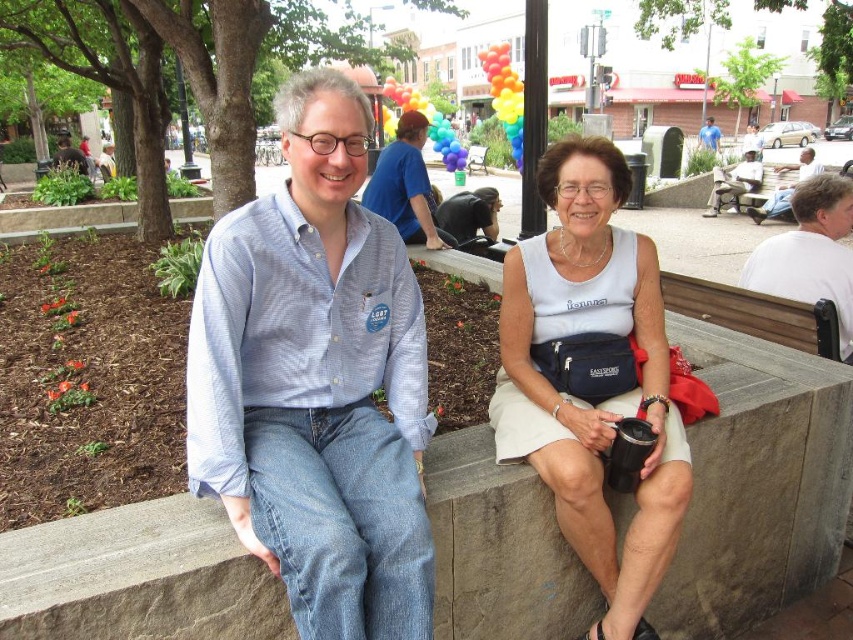
From the picture: Is white fabric tank top at center to the right of wooden bench at center from the viewer's perspective?

No, white fabric tank top at center is not to the right of wooden bench at center.

Which of these two, white fabric tank top at center or wooden bench at center, stands taller?

white fabric tank top at center is taller.

Is point (500, 404) positioned after point (471, 160)?

No, it is not.

Locate an element on the screen. white fabric tank top at center is located at coordinates (585, 400).